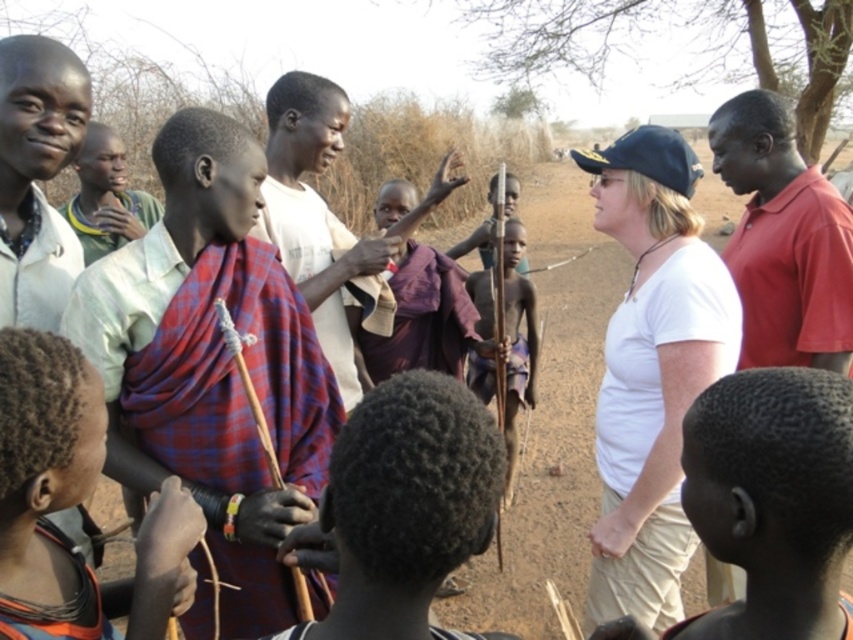
You are standing at the origin point in the image. Where is the red smooth shirt at right located in terms of coordinates?

The red smooth shirt at right is located at coordinates point (x=782, y=240).

You are a traveler who wants to wrap yourself in one of the two items available at the center of the scene to protect from the cold wind. Which item would be more effective for warmth, the plaid fabric scarf at center or the red plaid shawl at center?

The red plaid shawl at center is thicker than the plaid fabric scarf at center, so it would provide better insulation and warmth against the cold wind.